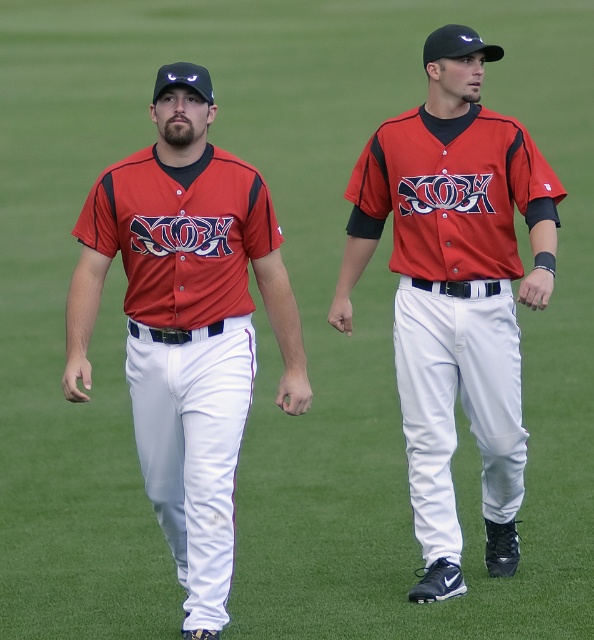
You are a photographer trying to capture a photo of both the matte red baseball uniform at center and the matte jersey at center. Since you want to ensure both are fully visible, which object should you focus on to account for their sizes?

The matte red baseball uniform at center is wider than the matte jersey at center. Therefore, focusing on the matte red baseball uniform at center ensures it fits within the frame, accommodating the smaller matte jersey at center as well.

You are a photographer trying to capture both the matte red baseball uniform at center and the matte jersey at center in a single shot. Since you want to ensure both are fully visible, which one should you focus on first to avoid cropping the shorter one out of the frame?

The matte red baseball uniform at center is shorter than the matte jersey at center. To ensure both are fully visible, you should focus on the matte jersey at center first since it is taller and requires more space in the frame.

You are standing at the edge of the baseball field and want to reach a specific point marked at coordinates point (x=191, y=220). If you can walk 3 feet per second, how long will it take you to reach that point?

The distance of point (x=191, y=220) from viewer is 25.50 feet. At a walking speed of 3 feet per second, it will take approximately 8.5 seconds to reach the point.